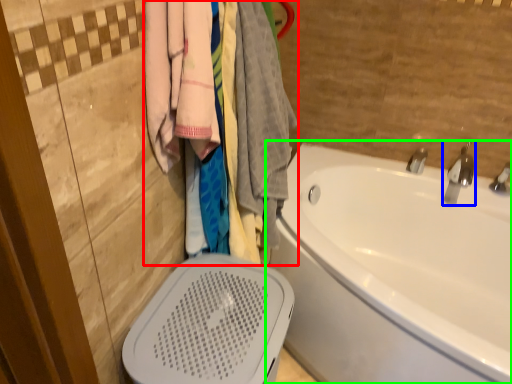
Question: Based on their relative distances, which object is farther from closet (highlighted by a red box)? Choose from tap (highlighted by a blue box) and bathtub (highlighted by a green box).

Choices:
 (A) tap
 (B) bathtub

Answer: (A)